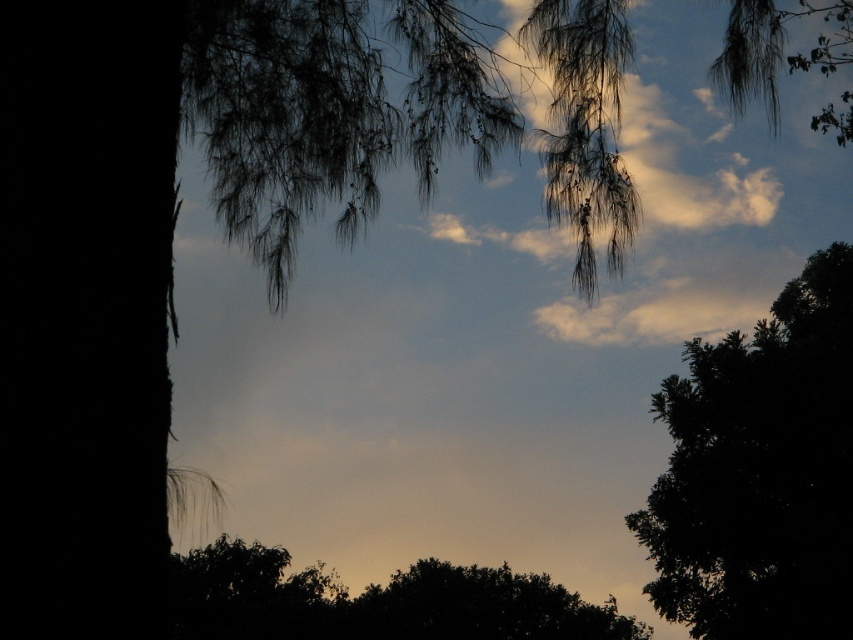
You are an observer looking at the dark green leafy tree at right and the dark green leafy tree at center. Which one appears higher in the image?

The dark green leafy tree at right is located above the dark green leafy tree at center, so it appears higher in the image.